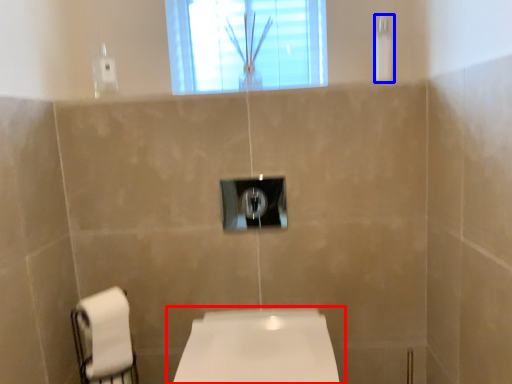
Question: Which object is closer to the camera taking this photo, toilet (highlighted by a red box) or shower (highlighted by a blue box)?

Choices:
 (A) toilet
 (B) shower

Answer: (A)